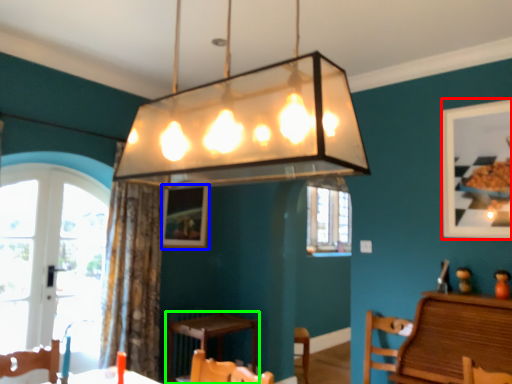
Question: Based on their relative distances, which object is nearer to picture frame (highlighted by a red box)? Choose from picture frame (highlighted by a blue box) and table (highlighted by a green box).

Choices:
 (A) picture frame
 (B) table

Answer: (B)